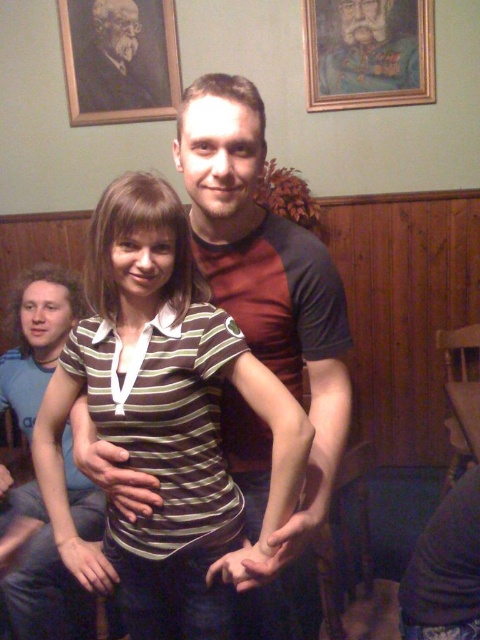
You are standing at point (x=143, y=13) and want to move to the woman in the horizontally striped shirt. Can you reach her without moving more than 3 meters?

Yes, because they are 3.00 meters apart, so you can reach her without moving more than 3 meters.